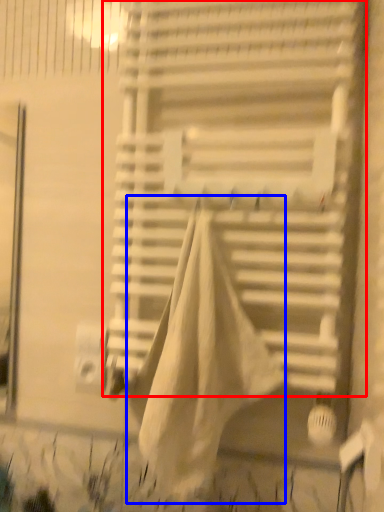
Question: Among these objects, which one is farthest to the camera, window blind (highlighted by a red box) or blanket (highlighted by a blue box)?

Choices:
 (A) window blind
 (B) blanket

Answer: (A)